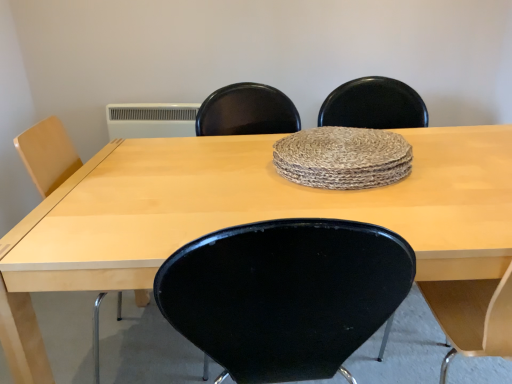
Question: Can you confirm if light wood table at center is thinner than natural fiber placemat at center?

Choices:
 (A) yes
 (B) no

Answer: (B)

Question: Is light wood table at center aimed at natural fiber placemat at center?

Choices:
 (A) yes
 (B) no

Answer: (B)

Question: From the image's perspective, does light wood table at center appear higher than natural fiber placemat at center?

Choices:
 (A) yes
 (B) no

Answer: (B)

Question: Can you confirm if light wood table at center is taller than natural fiber placemat at center?

Choices:
 (A) yes
 (B) no

Answer: (A)

Question: From a real-world perspective, is light wood table at center physically above natural fiber placemat at center?

Choices:
 (A) no
 (B) yes

Answer: (A)

Question: Considering the relative positions of light wood table at center and natural fiber placemat at center in the image provided, is light wood table at center to the left of natural fiber placemat at center from the viewer's perspective?

Choices:
 (A) no
 (B) yes

Answer: (B)

Question: From a real-world perspective, does natural fiber placemat at center sit lower than light wood table at center?

Choices:
 (A) yes
 (B) no

Answer: (B)

Question: Is natural fiber placemat at center directly adjacent to light wood table at center?

Choices:
 (A) no
 (B) yes

Answer: (A)

Question: Is natural fiber placemat at center turned away from light wood table at center?

Choices:
 (A) no
 (B) yes

Answer: (A)

Question: Is natural fiber placemat at center positioned before light wood table at center?

Choices:
 (A) yes
 (B) no

Answer: (B)

Question: Is natural fiber placemat at center not within light wood table at center?

Choices:
 (A) yes
 (B) no

Answer: (A)

Question: Is natural fiber placemat at center to the left of light wood table at center from the viewer's perspective?

Choices:
 (A) yes
 (B) no

Answer: (B)

Question: From a real-world perspective, relative to light wood table at center, is natural fiber placemat at center vertically above or below?

Choices:
 (A) above
 (B) below

Answer: (A)